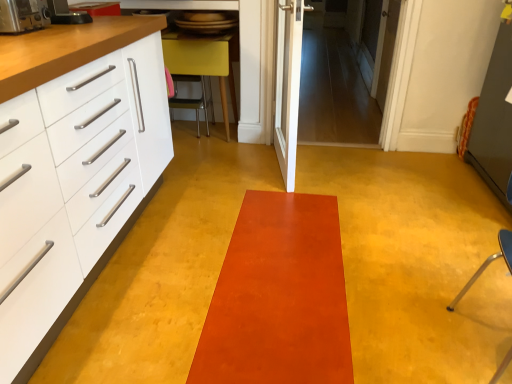
Question: Considering their positions, is satin orange mat at center located in front of or behind white wooden door at upper right, positioned as the 1th door in right-to-left order?

Choices:
 (A) front
 (B) behind

Answer: (A)

Question: Is satin orange mat at center bigger or smaller than white wooden door at upper right, which appears as the first door when viewed from the back?

Choices:
 (A) small
 (B) big

Answer: (A)

Question: Based on their relative distances, which object is farther from the white glossy door at center, the first door in the front-to-back sequence?

Choices:
 (A) satin orange mat at center
 (B) matte yellow chair at center, acting as the 1th furniture starting from the left
 (C) metallic silver toaster at left, positioned as the 1th appliance in front-to-back order
 (D) blue plastic chair at right, arranged as the first furniture when viewed from the front
 (E) metallic silver toaster at left, placed as the second appliance when sorted from front to back

Answer: (D)

Question: Which of these objects is positioned closest to the metallic silver toaster at left, positioned as the 1th appliance in front-to-back order?

Choices:
 (A) white wooden door at upper right, arranged as the 2th door when viewed from the left
 (B) blue plastic chair at right, which is the 1th furniture from right to left
 (C) white glossy door at center, the first door in the front-to-back sequence
 (D) satin orange mat at center
 (E) matte yellow chair at center, the second furniture from the right

Answer: (E)